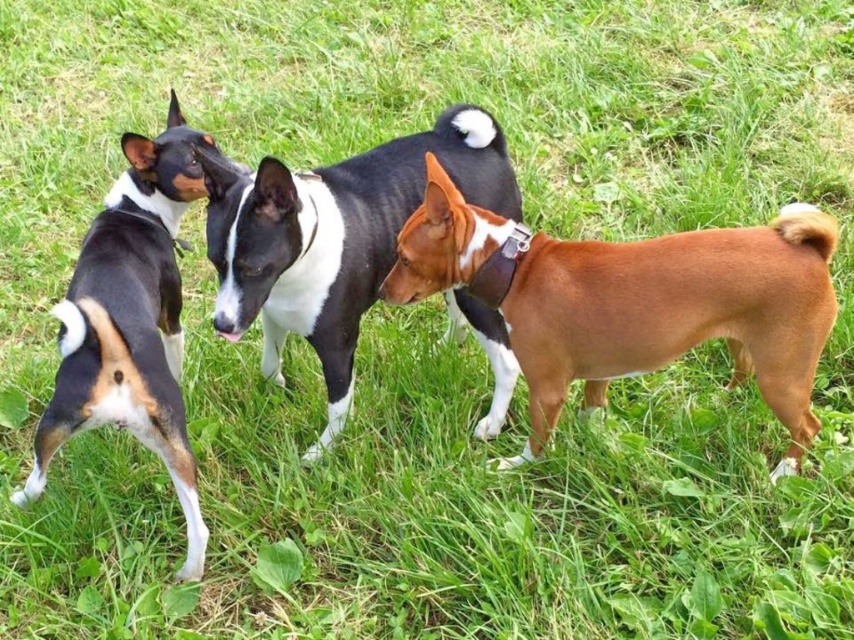
You are trying to fit both the brown leather dog at center and the black and white fur at left into a dog carrier that can only accommodate one dog at a time. Based on their sizes, which dog should you prioritize placing first?

The brown leather dog at center is wider than the black and white fur at left, so you should prioritize placing the brown leather dog at center first to ensure it fits properly before the narrower dog.

You are a photographer trying to capture a group photo of the black and white fur at left and the brown leather neckband at center. Which object is closer to the camera?

The brown leather neckband at center is closer to the camera because the black and white fur at left is positioned under it, indicating it is behind in the frame.